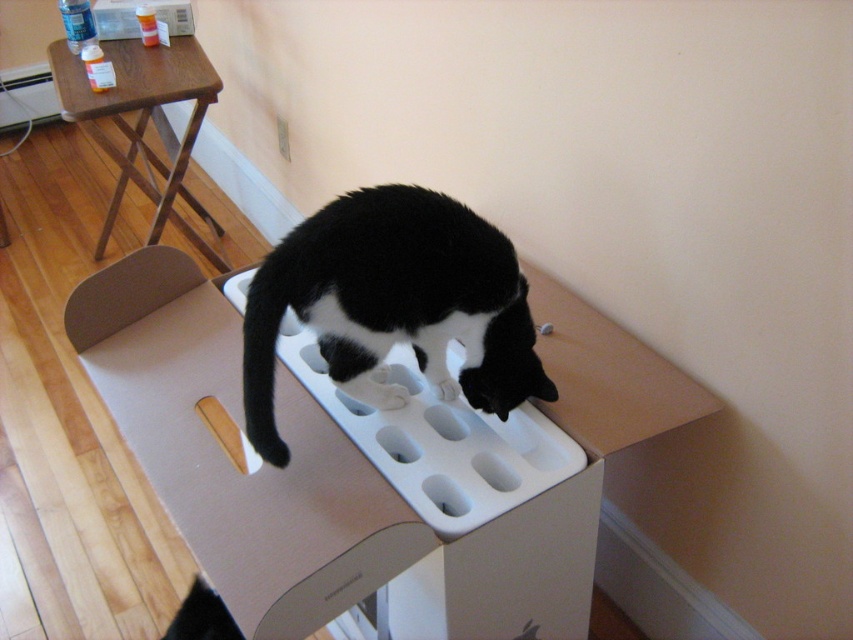
Which is behind, point (372, 292) or point (126, 92)?

The point (126, 92) is behind.

Between point (254, 358) and point (184, 74), which one is positioned behind?

The point (184, 74) is more distant.

At what (x,y) coordinates should I click in order to perform the action: click on black matte/object at center. Please return your answer as a coordinate pair (x, y). Looking at the image, I should click on (393, 305).